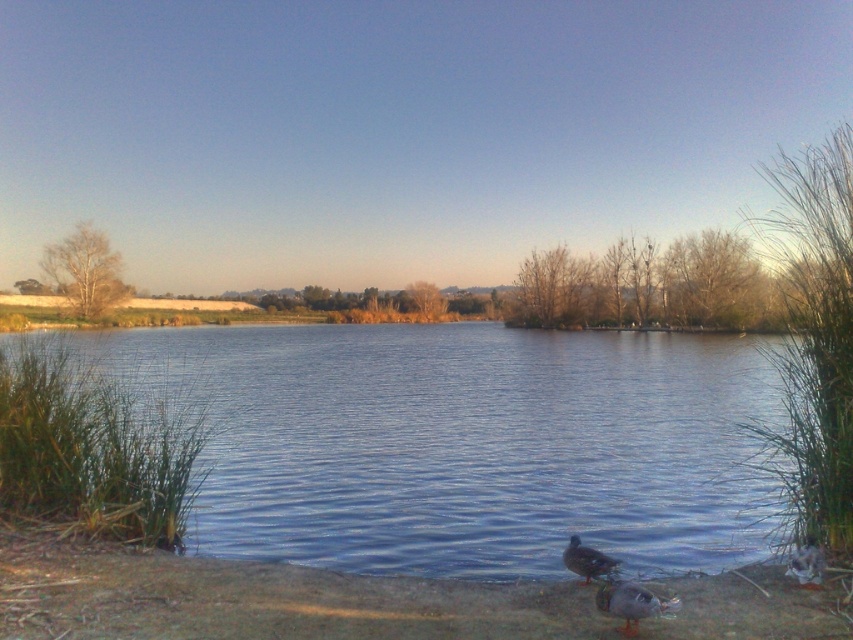
Question: Does dark gray feathers at lower right have a smaller size compared to dark brown feathers at lower center?

Choices:
 (A) no
 (B) yes

Answer: (A)

Question: Does brown dirt at lower center appear under dark brown feathers at lower center?

Choices:
 (A) no
 (B) yes

Answer: (B)

Question: Which point appears closest to the camera in this image?

Choices:
 (A) (105, 595)
 (B) (660, 611)
 (C) (683, 376)
 (D) (575, 556)

Answer: (B)

Question: Which of these objects is positioned farthest from the blue water at center?

Choices:
 (A) dark brown feathers at lower center
 (B) brown dirt at lower center

Answer: (B)

Question: Which of these objects is positioned closest to the blue water at center?

Choices:
 (A) dark gray feathers at lower right
 (B) brown dirt at lower center
 (C) dark brown feathers at lower center

Answer: (A)

Question: Does dark gray feathers at lower right have a lesser width compared to dark brown feathers at lower center?

Choices:
 (A) yes
 (B) no

Answer: (B)